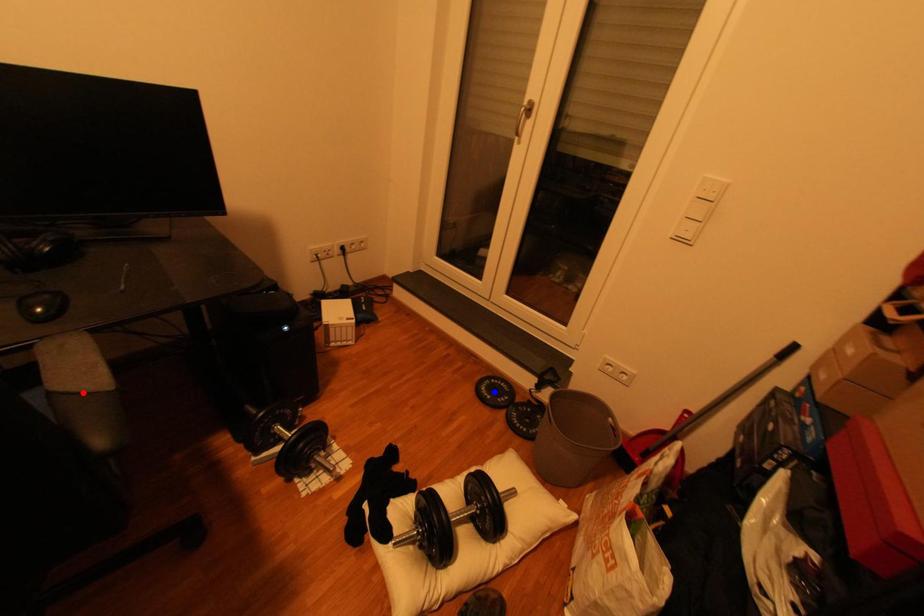
Question: Which of the two points in the image is closer to the camera?

Choices:
 (A) Blue point is closer.
 (B) Red point is closer.

Answer: (B)